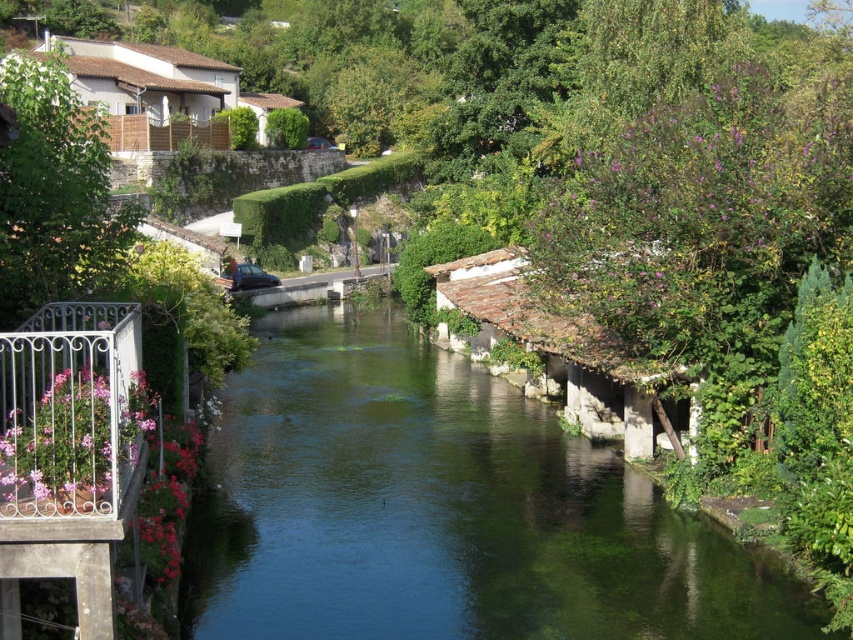
Does green stone river at center appear on the left side of metallic wrought iron balcony at lower left?

Incorrect, green stone river at center is not on the left side of metallic wrought iron balcony at lower left.

Who is positioned more to the right, green stone river at center or metallic wrought iron balcony at lower left?

green stone river at center

Is point (264, 460) less distant than point (73, 362)?

No, it is behind (73, 362).

You are a GUI agent. You are given a task and a screenshot of the screen. Output one action in this format:
    pyautogui.click(x=<x>, y=<y>)
    Task: Click on the green stone river at center
    This screenshot has height=640, width=853.
    Given the screenshot: What is the action you would take?
    pyautogui.click(x=444, y=509)